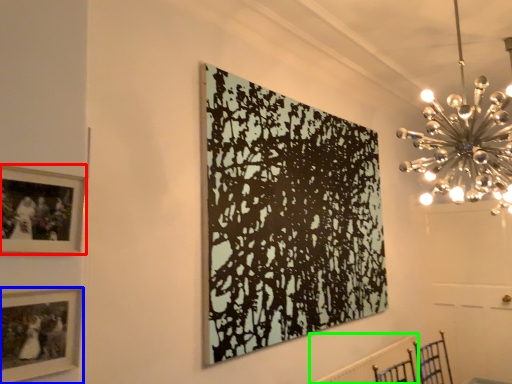
Question: Which object is the closest to the picture frame (highlighted by a red box)? Choose among these: picture frame (highlighted by a blue box) or radiator (highlighted by a green box).

Choices:
 (A) picture frame
 (B) radiator

Answer: (A)